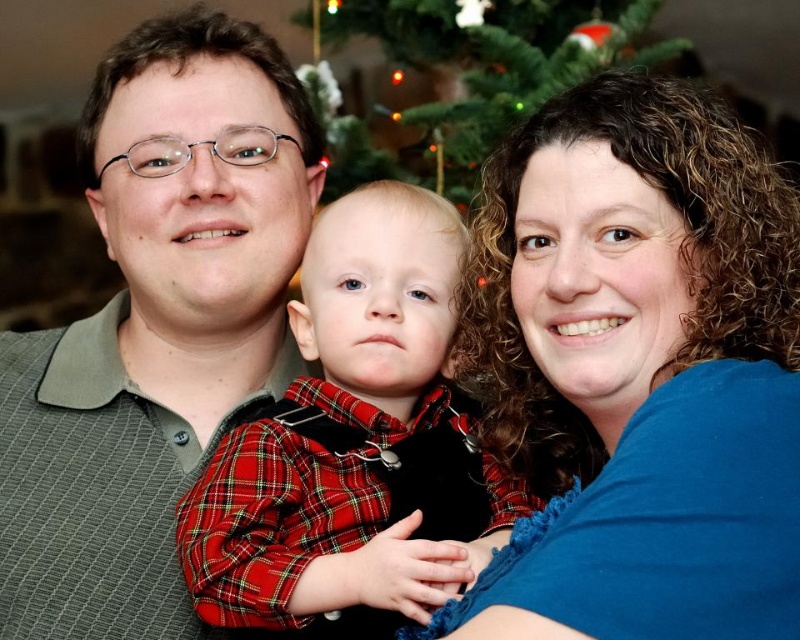
Describe the element at coordinates (154, 324) in the screenshot. Image resolution: width=800 pixels, height=640 pixels. I see `matte gray shirt at left` at that location.

Is point (286, 60) behind point (325, 348)?

Yes, point (286, 60) is behind point (325, 348).

I want to click on matte gray shirt at left, so click(154, 324).

Does matte gray shirt at left have a greater width compared to green textured christmas tree at upper center?

Incorrect, matte gray shirt at left's width does not surpass green textured christmas tree at upper center's.

Does point (244, 259) come in front of point (438, 116)?

Yes, it is.

Locate an element on the screen. The width and height of the screenshot is (800, 640). matte gray shirt at left is located at coordinates (154, 324).

Who is more distant from viewer, (640, 436) or (358, 284)?

The point (358, 284) is more distant.

Can you confirm if blue fabric at upper right is taller than red plaid shirt at center?

Indeed, blue fabric at upper right has a greater height compared to red plaid shirt at center.

The width and height of the screenshot is (800, 640). What do you see at coordinates (644, 362) in the screenshot? I see `blue fabric at upper right` at bounding box center [644, 362].

Identify the location of blue fabric at upper right. (644, 362).